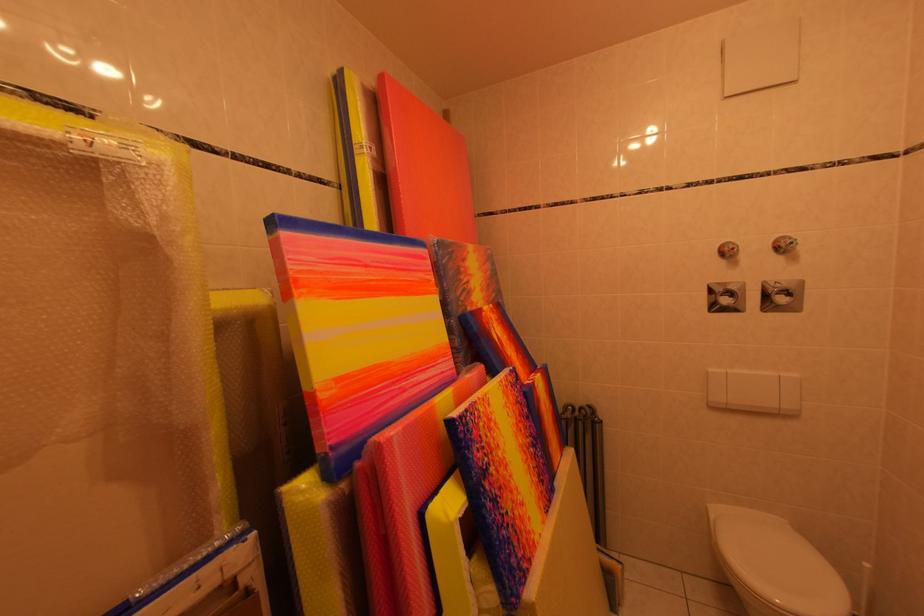
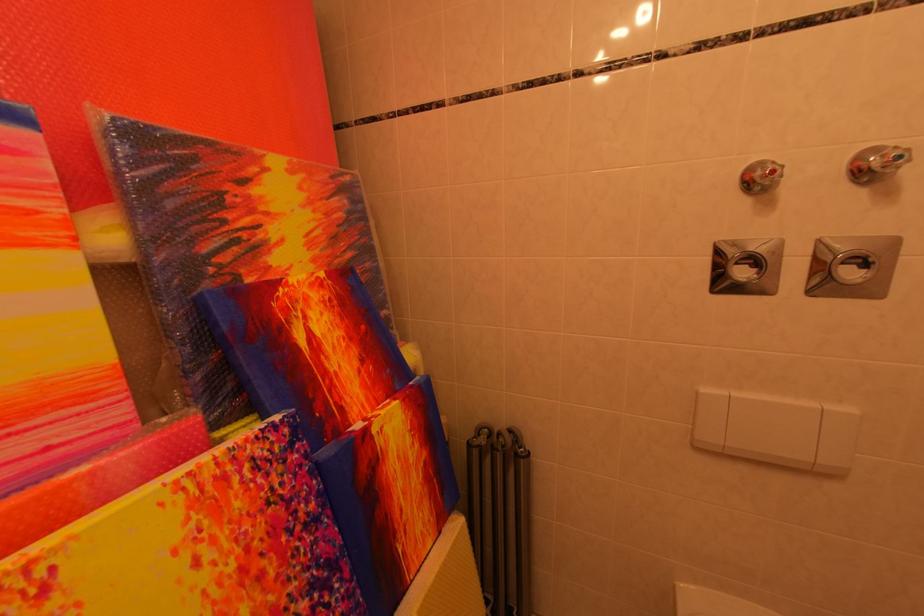
In the second image, find the point that corresponds to pixel 793 300 in the first image.

(864, 270)